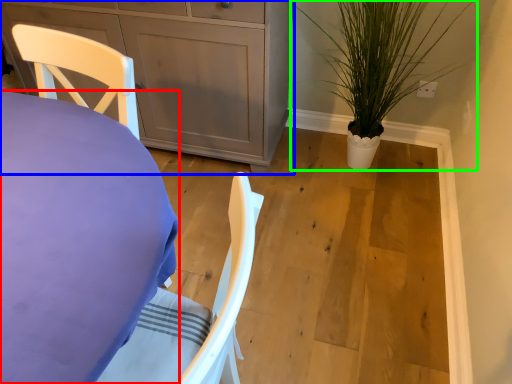
Question: Which object is positioned closest to desk (highlighted by a red box)? Select from cabinetry (highlighted by a blue box) and houseplant (highlighted by a green box).

Choices:
 (A) cabinetry
 (B) houseplant

Answer: (A)